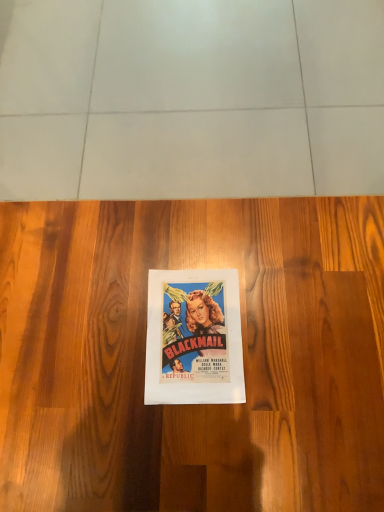
The image size is (384, 512). Identify the location of vacant location below matte paper poster at center (from a real-world perspective). (196, 329).